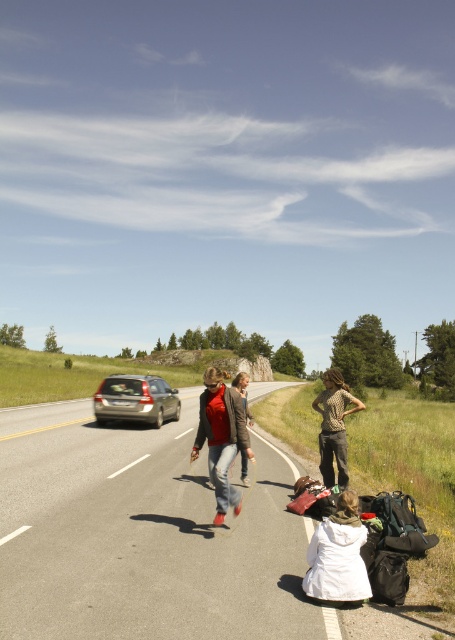
You are standing at the edge of the road and see the white cotton dress at lower center and the satin silver car at center. Which object is positioned to the right of the other?

The white cotton dress at lower center is to the right of the satin silver car at center.

You are a photographer standing at the edge of the road. You want to take a photo that includes both the matte red shoes at center and the leopard print shirt at center. Which object should you pan your camera towards first to ensure both are in frame?

You should pan your camera towards the matte red shoes at center first since it is to the left of the leopard print shirt at center, allowing both to be captured in the frame.

Based on the scene description, where are the matte red shoes at center located in the image?

The matte red shoes at center are located at point coordinates of 0.684 on the x axis and 0.486 on the y axis.